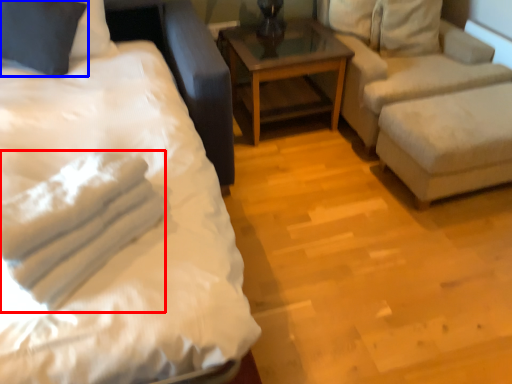
Question: Among these objects, which one is farthest to the camera, material (highlighted by a red box) or pillow (highlighted by a blue box)?

Choices:
 (A) material
 (B) pillow

Answer: (B)